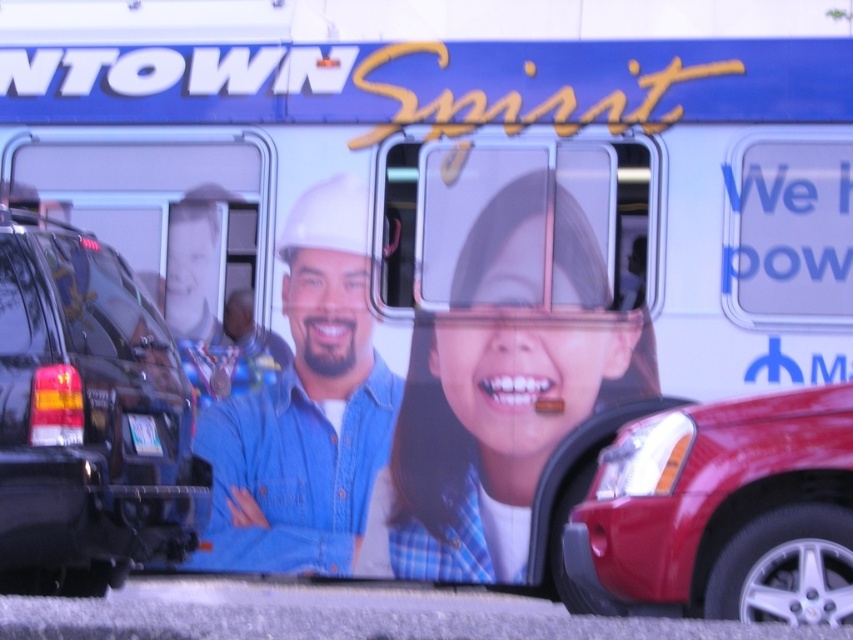
You are a delivery person trying to place a small package on the bus advertisement. The package must be placed at either point A or point B on the advertisement. Point A is at coordinates point (572, 416) and point B is at point (140, 436). Which point is closer to the bottom of the advertisement?

Point B at point (140, 436) is closer to the bottom of the advertisement since it has a lower y coordinate value than point A at point (572, 416).

You are a pedestrian standing in front of the bus advertisement. You see the shiny black suv at left and the white plastic license plate at center. Which object is closer to your left side?

The shiny black suv at left is closer to your left side because it is positioned to the left of the white plastic license plate at center.